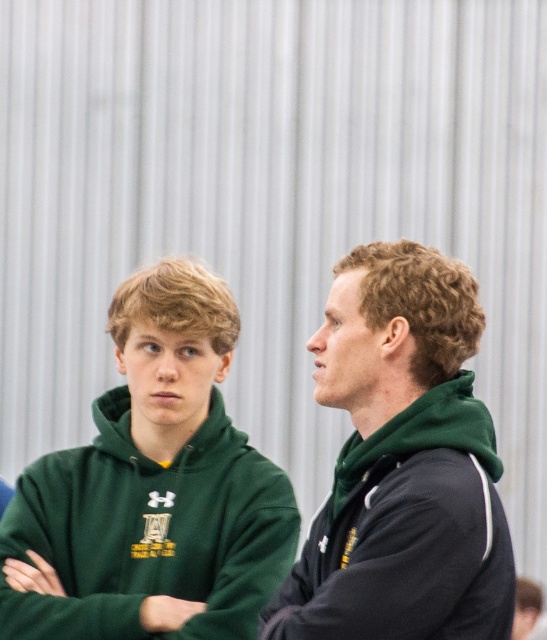
Question: Is the position of green fleece hoodie at left more distant than that of green matte hoodie at center?

Choices:
 (A) no
 (B) yes

Answer: (B)

Question: Is green fleece hoodie at left positioned behind green matte hoodie at center?

Choices:
 (A) yes
 (B) no

Answer: (A)

Question: Which of the following is the farthest from the observer?

Choices:
 (A) (146, 406)
 (B) (364, 401)

Answer: (A)

Question: Which point is closer to the camera?

Choices:
 (A) green fleece hoodie at left
 (B) green matte hoodie at center

Answer: (B)

Question: Among these points, which one is nearest to the camera?

Choices:
 (A) (130, 454)
 (B) (493, 506)

Answer: (B)

Question: Can you confirm if green fleece hoodie at left is positioned to the right of green matte hoodie at center?

Choices:
 (A) yes
 (B) no

Answer: (B)